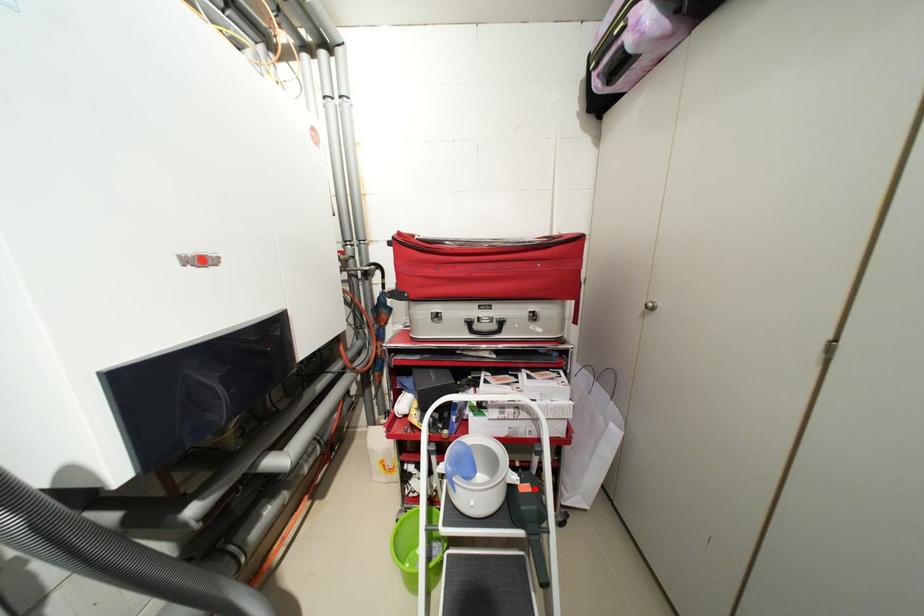
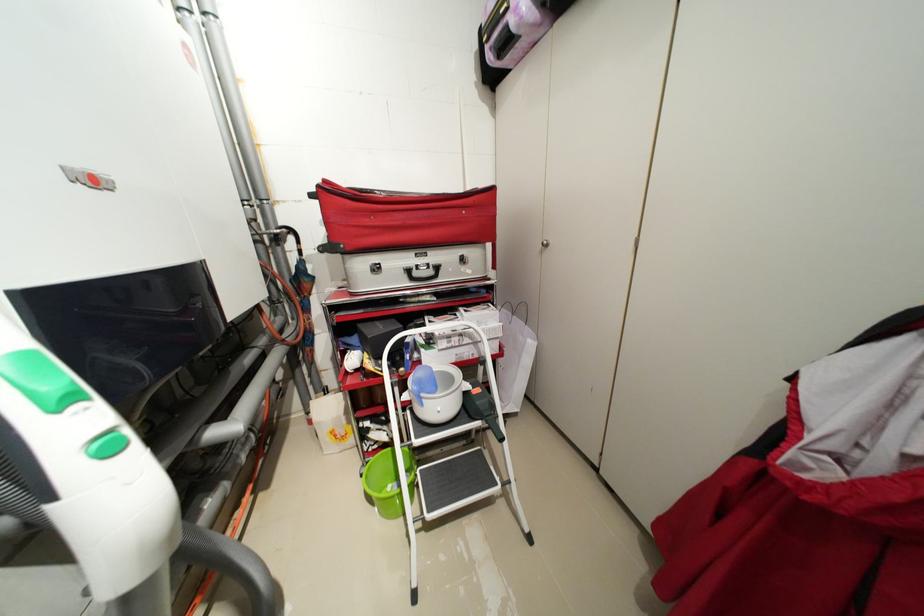
In the second image, find the point that corresponds to the highlighted location in the first image.

(484, 391)